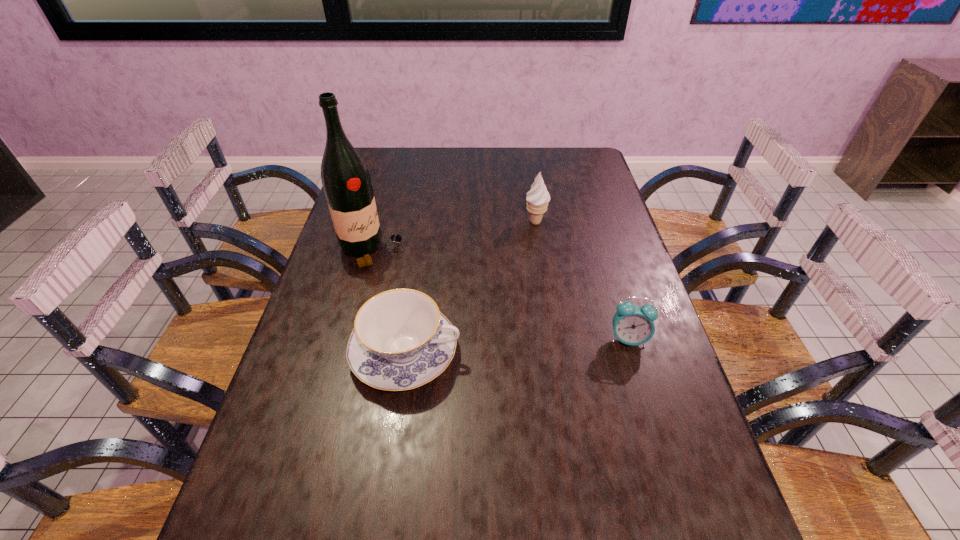
Where is `chinaware`? This screenshot has width=960, height=540. chinaware is located at coordinates (400, 341).

Locate an element on the screen. Image resolution: width=960 pixels, height=540 pixels. alarm clock is located at coordinates (633, 325).

Locate an element on the screen. Image resolution: width=960 pixels, height=540 pixels. the tallest object is located at coordinates (346, 181).

Find the location of a particular element. This screenshot has width=960, height=540. wine bottle is located at coordinates (346, 181).

You are a GUI agent. You are given a task and a screenshot of the screen. Output one action in this format:
    pyautogui.click(x=<x>, y=<y>)
    Task: Click on the second tallest object
    Image resolution: width=960 pixels, height=540 pixels.
    Given the screenshot: What is the action you would take?
    pyautogui.click(x=538, y=197)

Where is `the third object from left to right`? The height and width of the screenshot is (540, 960). the third object from left to right is located at coordinates (538, 197).

This screenshot has width=960, height=540. I want to click on free space located 0.260m with the handle on the side of the chinaware, so click(569, 353).

The image size is (960, 540). What are the coordinates of `free space located on the face of the alarm clock` in the screenshot? It's located at (638, 375).

Locate an element on the screen. This screenshot has height=540, width=960. vacant space located 0.150m on the surface of the second farthest object is located at coordinates (431, 286).

At what (x,y) coordinates should I click in order to perform the action: click on vacant space located on the surface of the second farthest object. Please return your answer as a coordinate pair (x, y). Image resolution: width=960 pixels, height=540 pixels. Looking at the image, I should click on (464, 307).